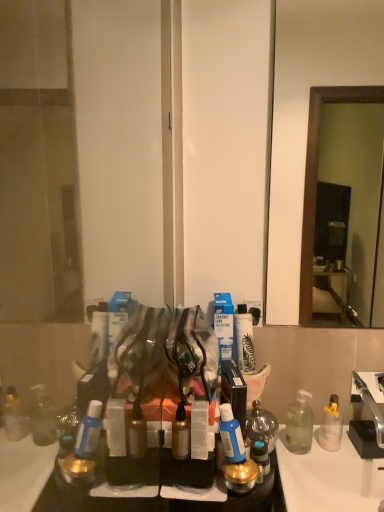
Question: Looking at their shapes, would you say translucent glass jar at center, arranged as the 1th toiletry when viewed from the right, is wider or thinner than blue glossy bottle at center, the 3th toiletry from the right?

Choices:
 (A) wide
 (B) thin

Answer: (A)

Question: From a real-world perspective, is translucent glass jar at center, arranged as the 1th toiletry when viewed from the right, physically located above or below blue glossy bottle at center, the third toiletry viewed from the left?

Choices:
 (A) above
 (B) below

Answer: (B)

Question: Estimate the real-world distances between objects in this image. Which object is closer to the transparent plastic screen door at left?

Choices:
 (A) blue glossy bottle at center, the third toiletry viewed from the left
 (B) silver metallic faucet at right
 (C) clear plastic container at center, the 2th toiletry viewed from the left
 (D) clear plastic soap dispenser at lower right
 (E) translucent glass jar at center, the 5th toiletry from the left

Answer: (C)

Question: Estimate the real-world distances between objects in this image. Which object is closer to the silver metallic faucet at right?

Choices:
 (A) translucent glass jar at center, the 5th toiletry from the left
 (B) clear plastic soap dispenser at lower right
 (C) clear plastic container at center, the 2th toiletry viewed from the left
 (D) metallic gold spray can at center, the 5th toiletry viewed from the right
 (E) blue glossy bottle at center, the third toiletry viewed from the left

Answer: (B)